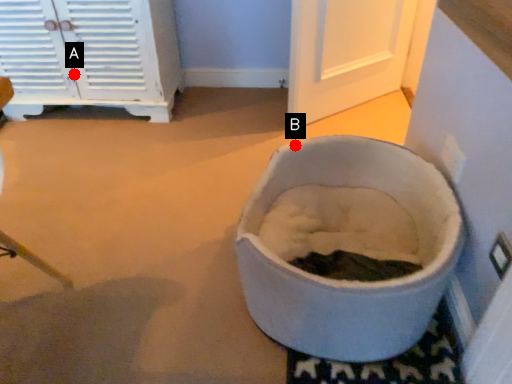
Question: Two points are circled on the image, labeled by A and B beside each circle. Which point appears closest to the camera in this image?

Choices:
 (A) A is closer
 (B) B is closer

Answer: (B)